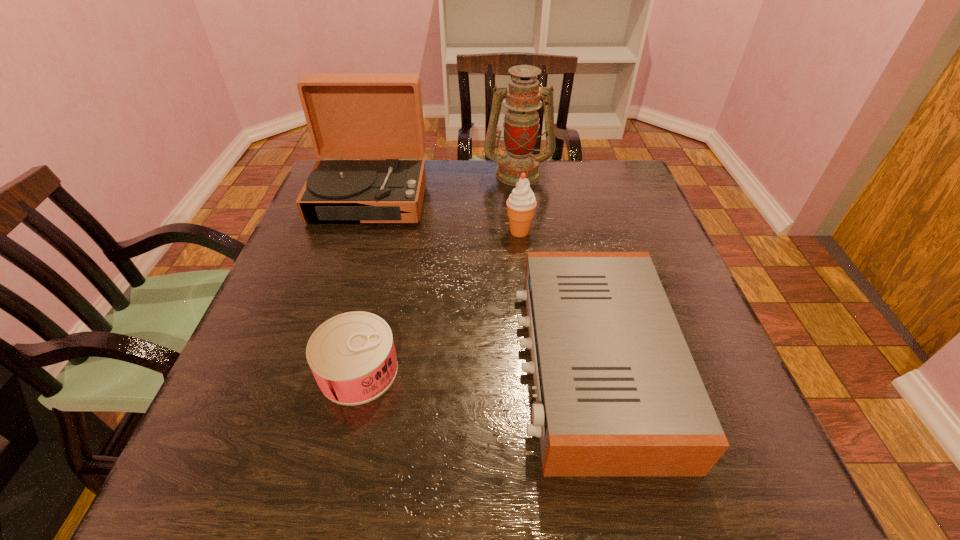
At what (x,y) coordinates should I click in order to perform the action: click on oil lamp. Please return your answer as a coordinate pair (x, y). The image size is (960, 540). Looking at the image, I should click on [521, 124].

This screenshot has width=960, height=540. I want to click on phonograph record, so click(x=349, y=116).

I want to click on the third shortest object, so click(521, 204).

You are a GUI agent. You are given a task and a screenshot of the screen. Output one action in this format:
    pyautogui.click(x=<x>, y=<y>)
    Task: Click on the radio receiver
    The image size is (960, 540).
    Given the screenshot: What is the action you would take?
    pyautogui.click(x=617, y=391)

The width and height of the screenshot is (960, 540). What are the coordinates of `the shortest object` in the screenshot? It's located at (352, 356).

At what (x,y) coordinates should I click in order to perform the action: click on vacant space located 0.070m on the front of the oil lamp. Please return your answer as a coordinate pair (x, y). Image resolution: width=960 pixels, height=540 pixels. Looking at the image, I should click on point(521,201).

Where is `vacant space situated on the face of the phonograph record`? This screenshot has width=960, height=540. vacant space situated on the face of the phonograph record is located at coordinates (323, 347).

Locate an element on the screen. vacant space positioned 0.070m on the back of the third tallest object is located at coordinates (516, 207).

Find the location of a particular element. The image size is (960, 540). vacant space situated on the control panel of the radio receiver is located at coordinates (339, 364).

This screenshot has width=960, height=540. Identify the location of blank space located on the control panel of the radio receiver. (488, 364).